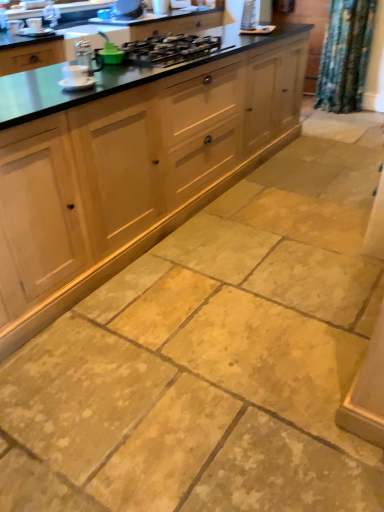
Question: Would you say white ceramic cup at upper left, arranged as the 3th appliance when viewed from the right, is outside metallic silver kettle at upper center, which is the 2th appliance from top to bottom?

Choices:
 (A) yes
 (B) no

Answer: (A)

Question: Considering the relative positions of white ceramic cup at upper left, which is the fifth appliance from back to front, and metallic silver kettle at upper center, which is the fourth appliance from bottom to top, in the image provided, is white ceramic cup at upper left, which is the fifth appliance from back to front, in front of metallic silver kettle at upper center, which is the fourth appliance from bottom to top,?

Choices:
 (A) no
 (B) yes

Answer: (B)

Question: Is white ceramic cup at upper left, arranged as the 3th appliance when viewed from the right, next to metallic silver kettle at upper center, marked as the second appliance in a back-to-front arrangement?

Choices:
 (A) yes
 (B) no

Answer: (B)

Question: Does white ceramic cup at upper left, the 5th appliance from the top, appear on the right side of metallic silver kettle at upper center, the 4th appliance when ordered from front to back?

Choices:
 (A) no
 (B) yes

Answer: (B)

Question: Does white ceramic cup at upper left, which is counted as the 3th appliance, starting from the left, have a lesser height compared to metallic silver kettle at upper center, the fourth appliance in the right-to-left sequence?

Choices:
 (A) no
 (B) yes

Answer: (B)

Question: Is metallic black gas stove at center inside the boundaries of metallic silver kettle at upper center, the fourth appliance in the right-to-left sequence, or outside?

Choices:
 (A) inside
 (B) outside

Answer: (B)

Question: From the image's perspective, is metallic black gas stove at center above or below metallic silver kettle at upper center, the fourth appliance in the right-to-left sequence?

Choices:
 (A) above
 (B) below

Answer: (B)

Question: In the image, is metallic black gas stove at center on the left side or the right side of metallic silver kettle at upper center, marked as the second appliance in a back-to-front arrangement?

Choices:
 (A) right
 (B) left

Answer: (A)

Question: Is point (203, 47) closer or farther from the camera than point (130, 11)?

Choices:
 (A) closer
 (B) farther

Answer: (A)

Question: Relative to metallic silver kettle at upper center, which is the 2th appliance from top to bottom, is natural wood cabinets at center in front or behind?

Choices:
 (A) front
 (B) behind

Answer: (A)

Question: Considering the positions of point (92, 260) and point (119, 10), is point (92, 260) closer or farther from the camera than point (119, 10)?

Choices:
 (A) closer
 (B) farther

Answer: (A)

Question: From the image's perspective, is natural wood cabinets at center positioned above or below metallic silver kettle at upper center, the fourth appliance in the right-to-left sequence?

Choices:
 (A) above
 (B) below

Answer: (B)

Question: Is natural wood cabinets at center taller or shorter than metallic silver kettle at upper center, which is the 2th appliance from top to bottom?

Choices:
 (A) short
 (B) tall

Answer: (B)

Question: Is matte white cup at upper left, the 3th appliance ordered from the bottom, in front of or behind natural wood cabinets at center in the image?

Choices:
 (A) behind
 (B) front

Answer: (A)

Question: Considering the positions of matte white cup at upper left, the fifth appliance positioned from the right, and natural wood cabinets at center in the image, is matte white cup at upper left, the fifth appliance positioned from the right, bigger or smaller than natural wood cabinets at center?

Choices:
 (A) small
 (B) big

Answer: (A)